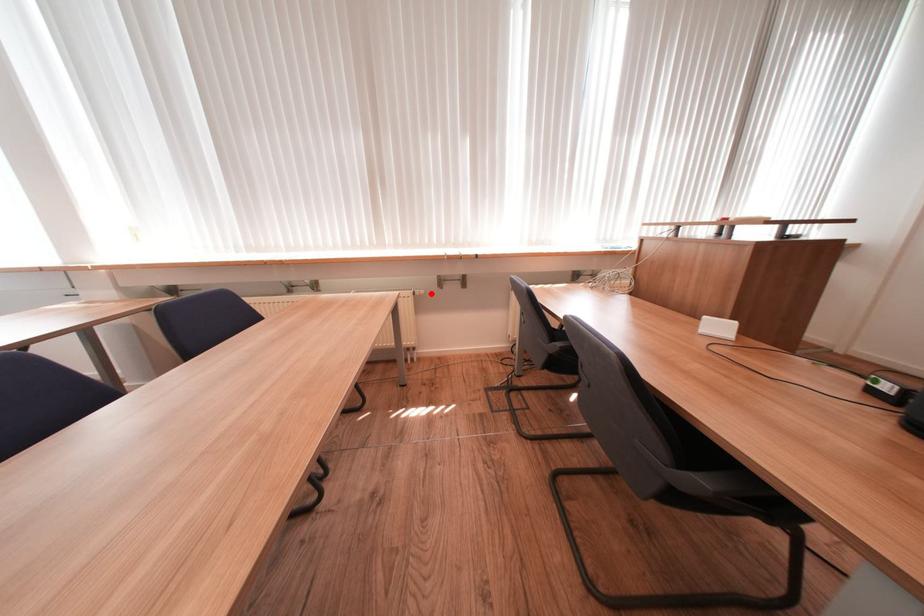
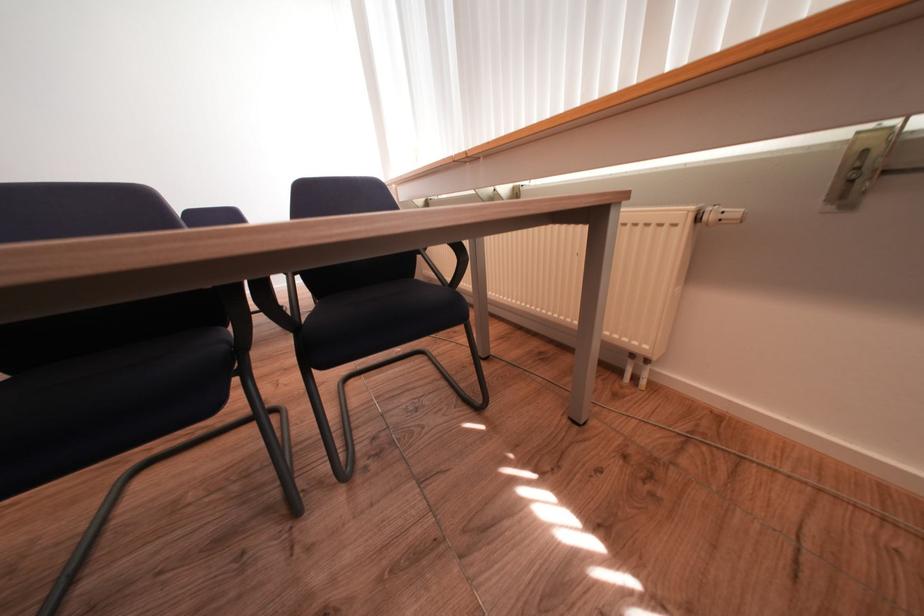
The point at the highlighted location is marked in the first image. Where is the corresponding point in the second image?

(745, 215)